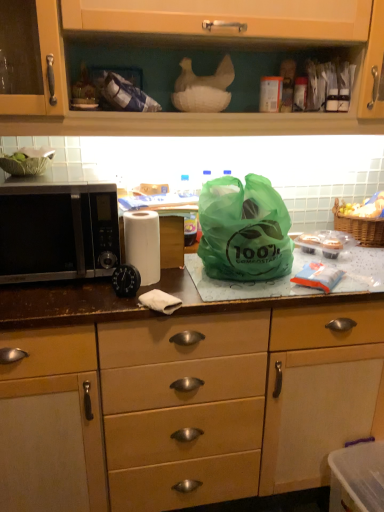
Question: Is black matte microwave at left not near matte wood cabinet at upper center, positioned as the 1th cabinetry in top-to-bottom order?

Choices:
 (A) no
 (B) yes

Answer: (A)

Question: Considering the relative sizes of black matte microwave at left and matte wood cabinet at upper center, which is the second cabinetry in bottom-to-top order, in the image provided, is black matte microwave at left wider than matte wood cabinet at upper center, which is the second cabinetry in bottom-to-top order,?

Choices:
 (A) no
 (B) yes

Answer: (B)

Question: From a real-world perspective, is black matte microwave at left under matte wood cabinet at upper center, which is the second cabinetry in bottom-to-top order?

Choices:
 (A) no
 (B) yes

Answer: (B)

Question: Are black matte microwave at left and matte wood cabinet at upper center, which is the second cabinetry in bottom-to-top order, beside each other?

Choices:
 (A) no
 (B) yes

Answer: (A)

Question: Would you say black matte microwave at left is outside matte wood cabinet at upper center, positioned as the 1th cabinetry in top-to-bottom order?

Choices:
 (A) yes
 (B) no

Answer: (A)

Question: In terms of height, does white matte paper towel at center look taller or shorter compared to black matte microwave at left?

Choices:
 (A) short
 (B) tall

Answer: (A)

Question: Looking at the image, does white matte paper towel at center seem bigger or smaller compared to black matte microwave at left?

Choices:
 (A) small
 (B) big

Answer: (A)

Question: From the image's perspective, relative to black matte microwave at left, is white matte paper towel at center above or below?

Choices:
 (A) below
 (B) above

Answer: (A)

Question: Is white matte paper towel at center wider or thinner than black matte microwave at left?

Choices:
 (A) thin
 (B) wide

Answer: (A)

Question: Is white matte paper towel at center taller or shorter than woven brown picnic basket at right?

Choices:
 (A) short
 (B) tall

Answer: (B)

Question: In terms of size, does white matte paper towel at center appear bigger or smaller than woven brown picnic basket at right?

Choices:
 (A) small
 (B) big

Answer: (A)

Question: Based on their positions, is white matte paper towel at center located to the left or right of woven brown picnic basket at right?

Choices:
 (A) right
 (B) left

Answer: (B)

Question: Considering the positions of point (137, 222) and point (372, 243), is point (137, 222) closer or farther from the camera than point (372, 243)?

Choices:
 (A) closer
 (B) farther

Answer: (A)

Question: Considering the relative positions of woven brown picnic basket at right and green translucent bag at center in the image provided, is woven brown picnic basket at right to the left or to the right of green translucent bag at center?

Choices:
 (A) left
 (B) right

Answer: (B)

Question: From the image's perspective, relative to green translucent bag at center, is woven brown picnic basket at right above or below?

Choices:
 (A) below
 (B) above

Answer: (B)